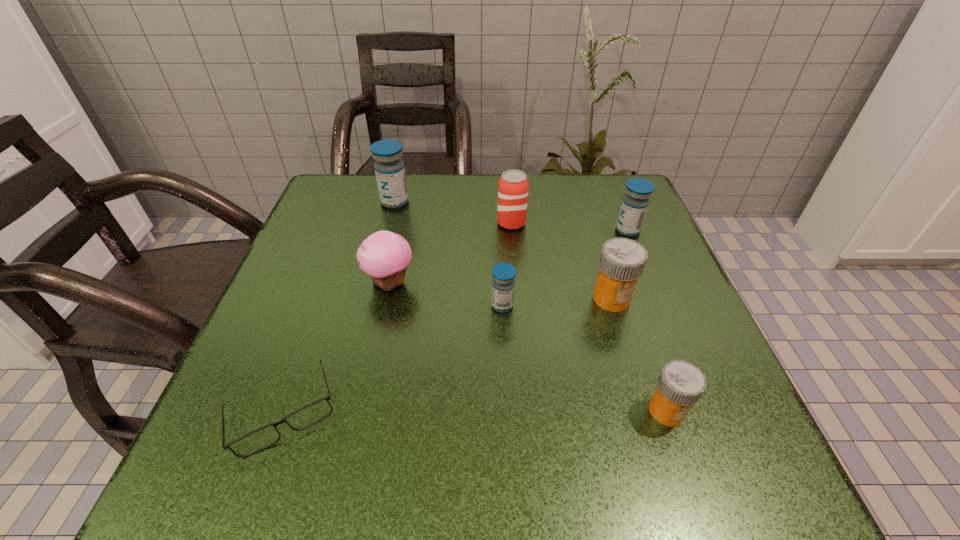
You are a GUI agent. You are given a task and a screenshot of the screen. Output one action in this format:
    pyautogui.click(x=<x>, y=<y>)
    Task: Click on the smaller orange medicine
    
    Given the screenshot: What is the action you would take?
    pyautogui.click(x=680, y=384)

This screenshot has height=540, width=960. Identify the location of spectacles. 309,415.

I want to click on vacant space situated 0.170m on the front of the farthest medicine, so click(x=381, y=255).

Where is `free location located on the front of the orange beer can`? This screenshot has height=540, width=960. free location located on the front of the orange beer can is located at coordinates (514, 254).

Identify the location of free location located 0.060m on the back of the second nearest blue medicine. (619, 208).

Locate an element on the screen. The height and width of the screenshot is (540, 960). vacant region located 0.180m on the label side of the bigger orange medicine is located at coordinates (641, 397).

Find the location of a particular element. Image resolution: width=960 pixels, height=540 pixels. vacant area situated on the left of the pink cupcake is located at coordinates (300, 283).

You are a GUI agent. You are given a task and a screenshot of the screen. Output one action in this format:
    pyautogui.click(x=<x>, y=<y>)
    Task: Click on the free location located 0.170m on the back of the smallest blue medicine
    
    Given the screenshot: What is the action you would take?
    pyautogui.click(x=499, y=243)

Locate an element on the screen. Image resolution: width=960 pixels, height=540 pixels. free spot located on the label side of the nearest medicine is located at coordinates (691, 483).

At what (x,y) coordinates should I click in order to perform the action: click on beer can present at the far edge. Please return your answer as a coordinate pair (x, y). This screenshot has height=540, width=960. Looking at the image, I should click on (513, 187).